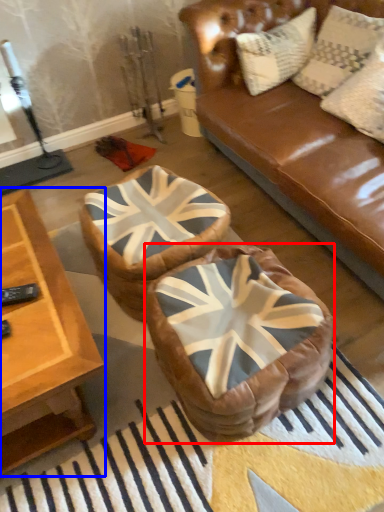
Question: Among these objects, which one is farthest to the camera, bean bag chair (highlighted by a red box) or table (highlighted by a blue box)?

Choices:
 (A) bean bag chair
 (B) table

Answer: (A)